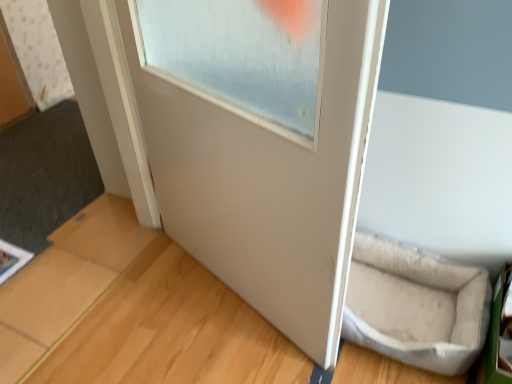
I want to click on vacant area situated to the left side of beige fabric pet bed at lower right, so coord(245,339).